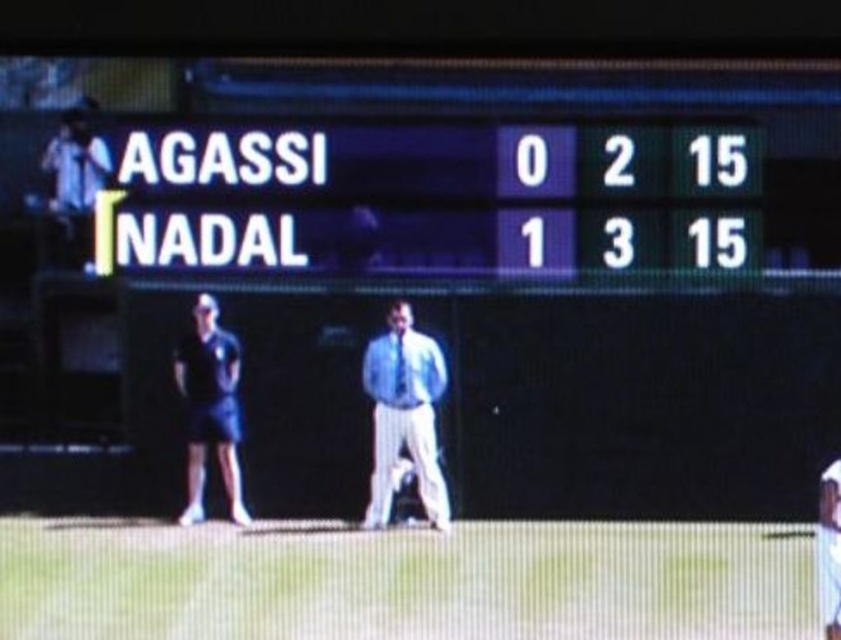
What do you see at coordinates (210, 406) in the screenshot?
I see `dark blue fabric shorts at left` at bounding box center [210, 406].

Is point (221, 392) farther from viewer compared to point (839, 604)?

Yes, it is behind point (839, 604).

The image size is (841, 640). Find the location of `dark blue fabric shorts at left`. dark blue fabric shorts at left is located at coordinates (210, 406).

Is light blue pinstripe pants at center above white cotton shirt at lower right?

Yes.

Does light blue pinstripe pants at center have a greater height compared to white cotton shirt at lower right?

Correct, light blue pinstripe pants at center is much taller as white cotton shirt at lower right.

Is point (416, 349) less distant than point (829, 529)?

No.

Identify the location of light blue pinstripe pants at center. This screenshot has height=640, width=841. (405, 413).

Who is higher up, light blue pinstripe pants at center or dark blue fabric shorts at left?

dark blue fabric shorts at left is above.

Is point (430, 516) closer to camera compared to point (220, 333)?

No, (430, 516) is further to viewer.

This screenshot has width=841, height=640. Identify the location of light blue pinstripe pants at center. (405, 413).